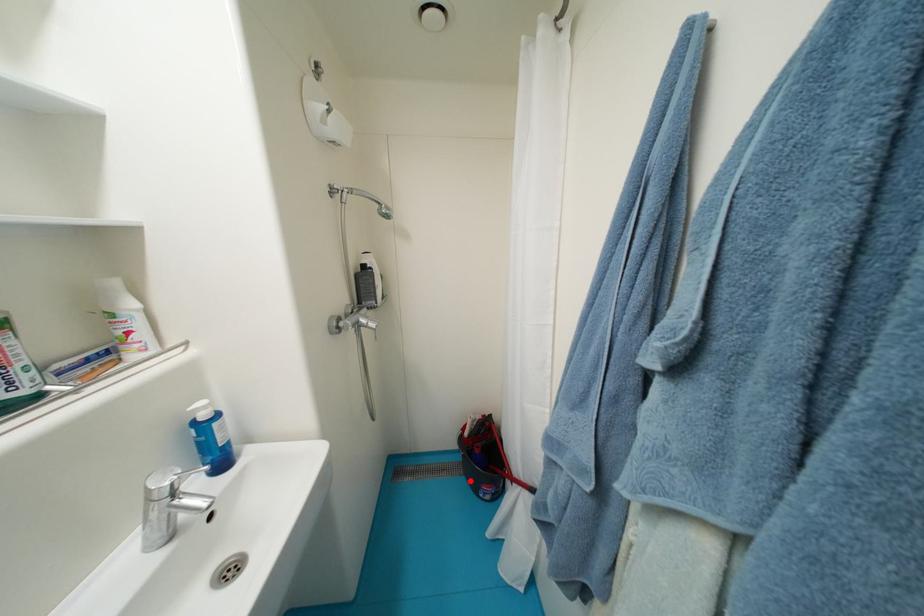
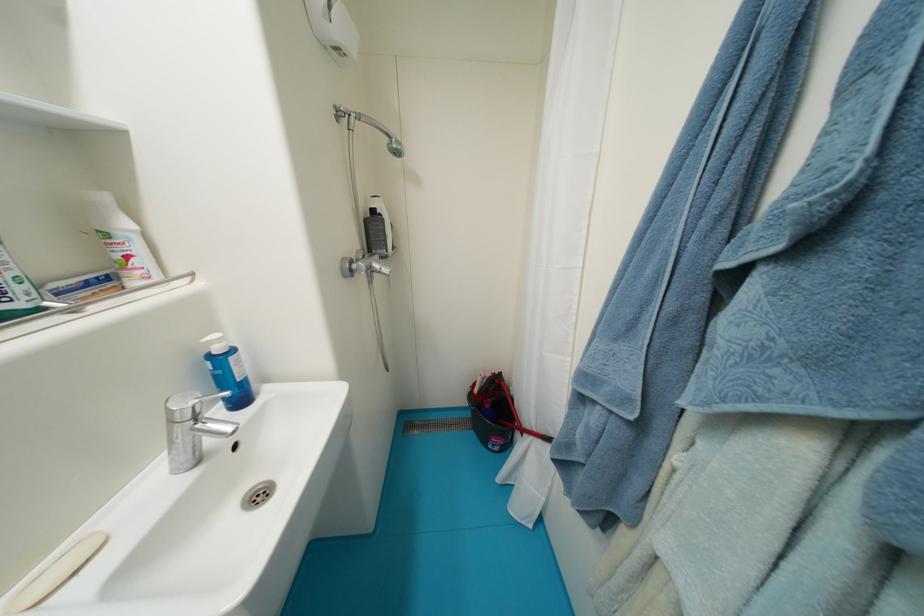
Locate, in the second image, the point that corresponds to the highlighted location in the first image.

(479, 435)